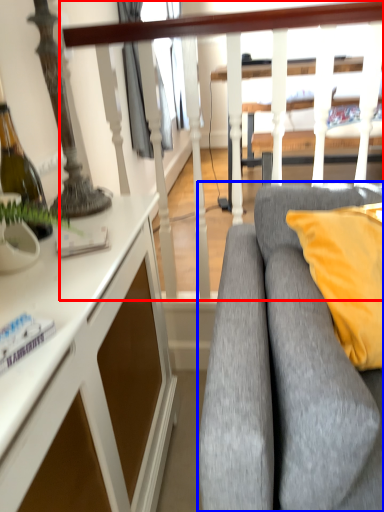
Question: Which object appears closest to the camera in this image, rail (highlighted by a red box) or studio couch (highlighted by a blue box)?

Choices:
 (A) rail
 (B) studio couch

Answer: (B)